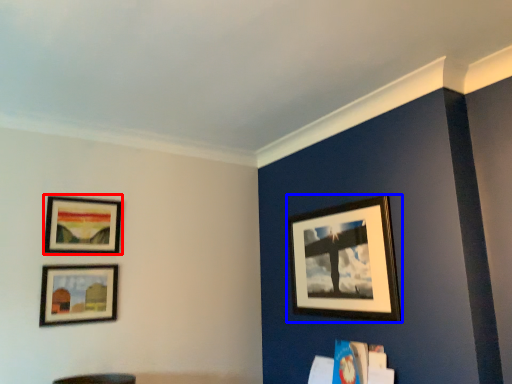
Question: Which object appears farthest to the camera in this image, picture frame (highlighted by a red box) or picture frame (highlighted by a blue box)?

Choices:
 (A) picture frame
 (B) picture frame

Answer: (A)